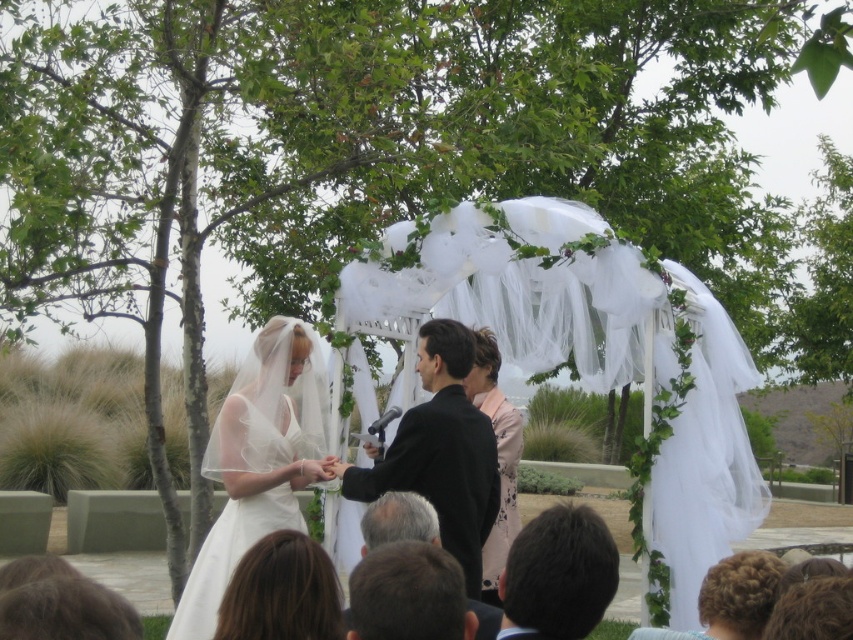
You are a photographer at the wedding ceremony. You want to capture a photo that includes both the white sheer fabric canopy at center and the gray hair at lower center. Which object should you focus on first to ensure both are in the frame?

You should focus on the white sheer fabric canopy at center first because it is closer to the viewer than the gray hair at lower center, ensuring both are in the frame.

In the scene shown: You are a photographer at the wedding ceremony. You want to capture a closeup of the dark brown hair at lower center. What coordinates should you focus on?

The dark brown hair at lower center is located at coordinates point (408, 595), so you should focus there.

Looking at this image, you are a photographer at the wedding ceremony. You want to take a photo that includes both points marked as point (456, 428) and point (328, 580). Based on their positions, which point is closer to the camera?

Point (328, 580) is closer to the camera than point (456, 428).